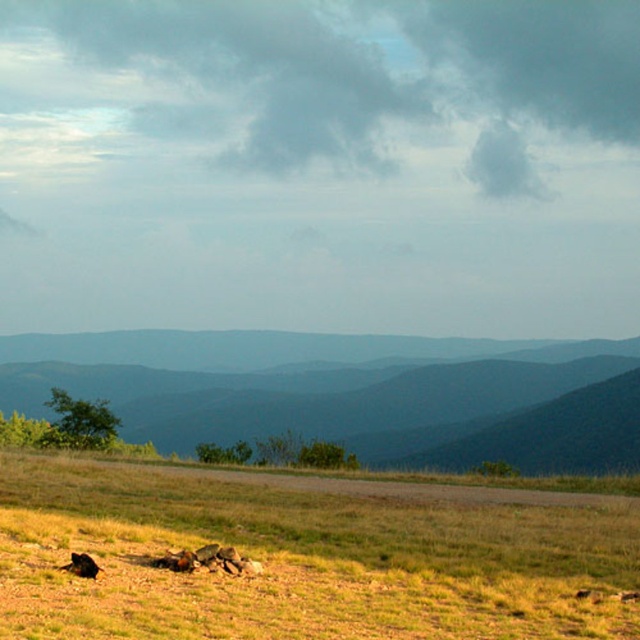
Question: Is the position of green grassy hillside at center more distant than that of shiny black dog at lower left?

Choices:
 (A) yes
 (B) no

Answer: (A)

Question: Which object appears farthest from the camera in this image?

Choices:
 (A) shiny black dog at lower left
 (B) green grassy hillside at center

Answer: (B)

Question: From the image, what is the correct spatial relationship of green grassy hillside at center in relation to shiny black dog at lower left?

Choices:
 (A) left
 (B) right

Answer: (B)

Question: Is green grassy hillside at center thinner than shiny black dog at lower left?

Choices:
 (A) yes
 (B) no

Answer: (B)